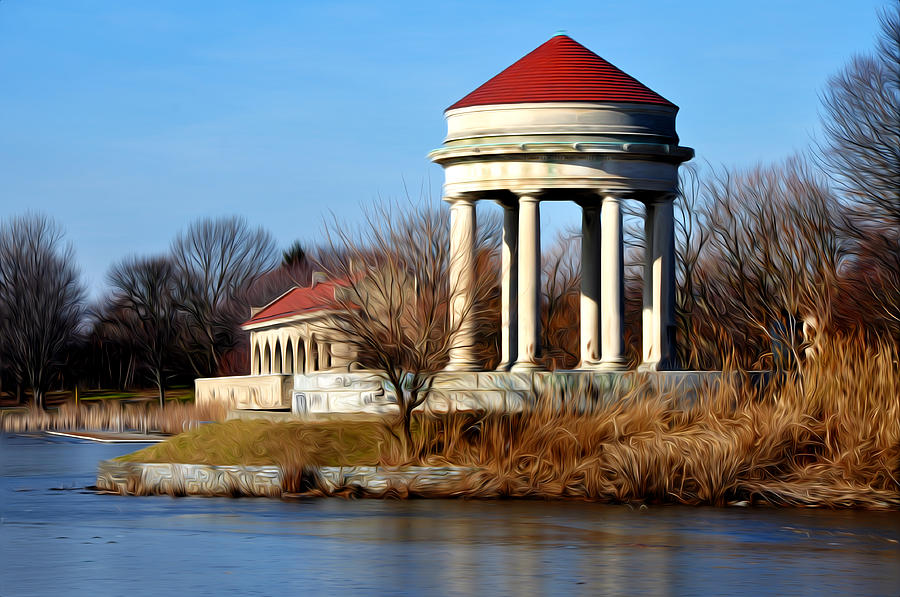
Where is `columns`? This screenshot has width=900, height=597. columns is located at coordinates pyautogui.click(x=329, y=347), pyautogui.click(x=299, y=347), pyautogui.click(x=267, y=352), pyautogui.click(x=254, y=355), pyautogui.click(x=280, y=347).